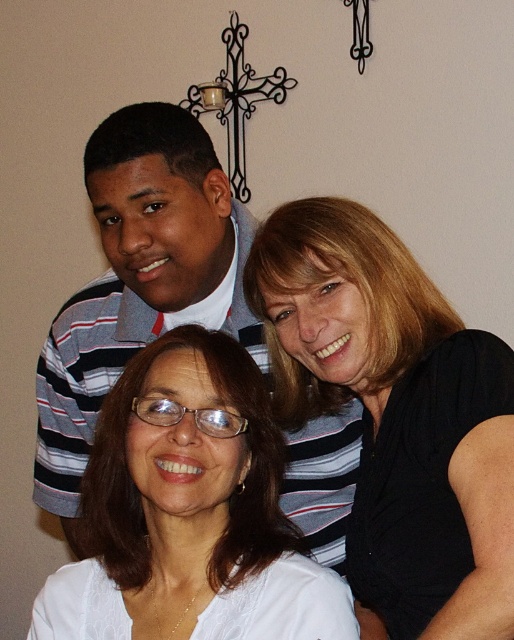
Who is more forward, [486,410] or [284,552]?

Point [486,410]

Identify the location of black matte shirt at upper right. The image size is (514, 640). (394, 410).